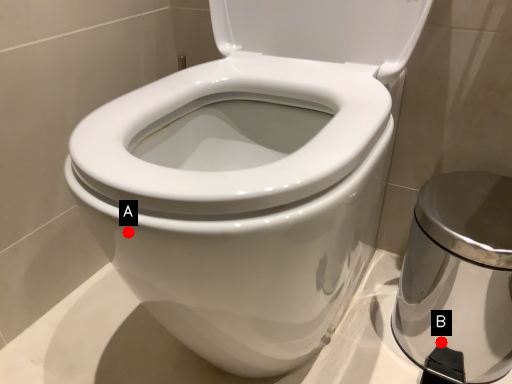
Question: Two points are circled on the image, labeled by A and B beside each circle. Which point appears closest to the camera in this image?

Choices:
 (A) A is closer
 (B) B is closer

Answer: (A)